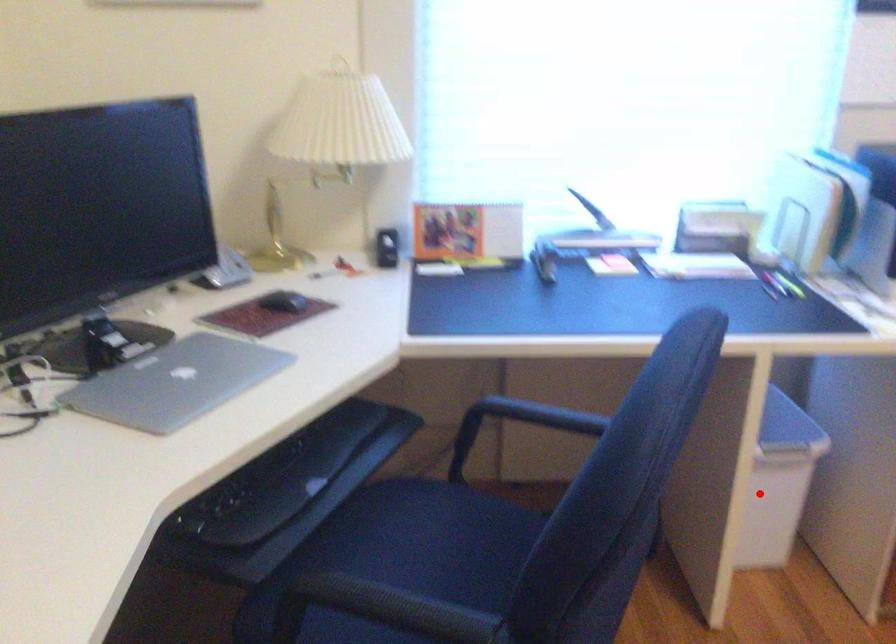
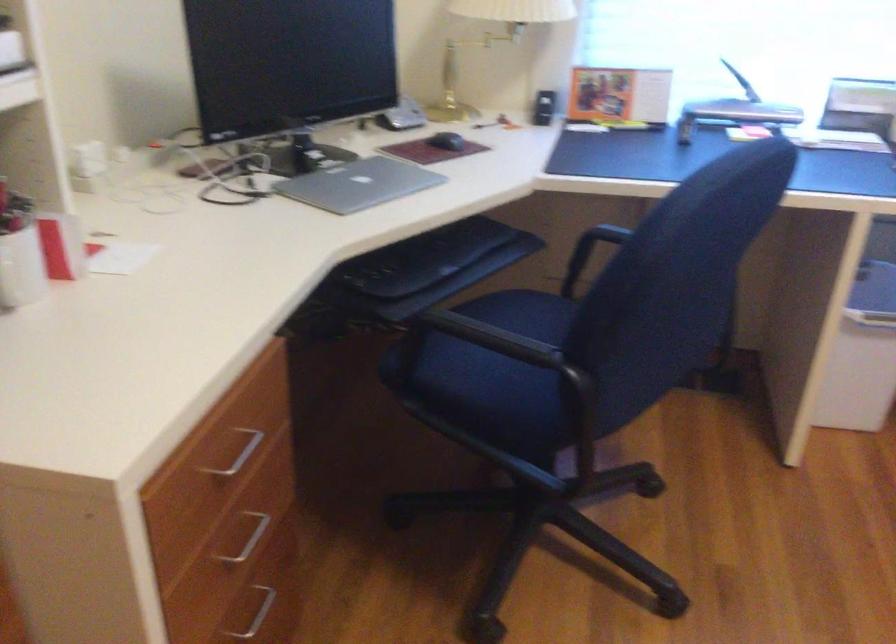
Where in the second image is the point corresponding to the highlighted location from the first image?

(862, 355)